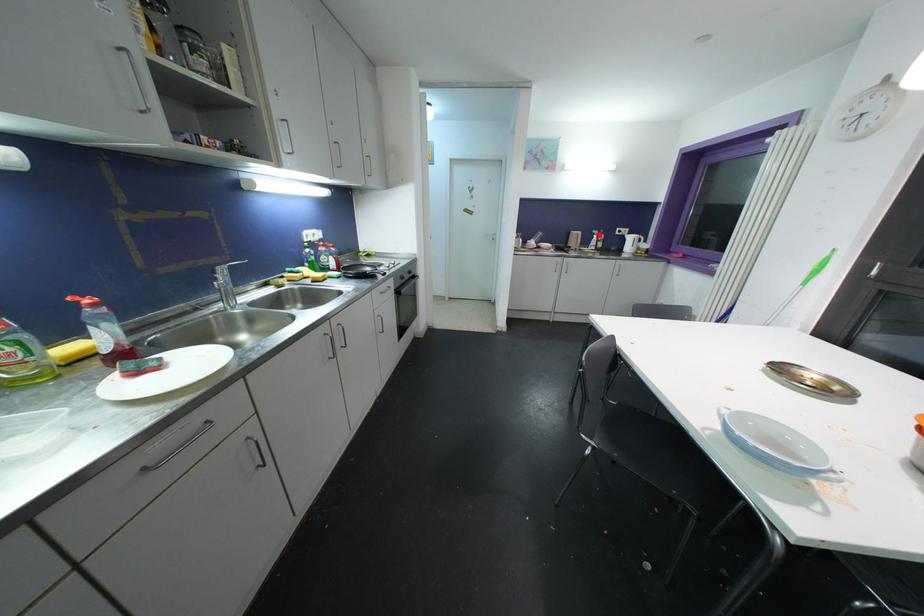
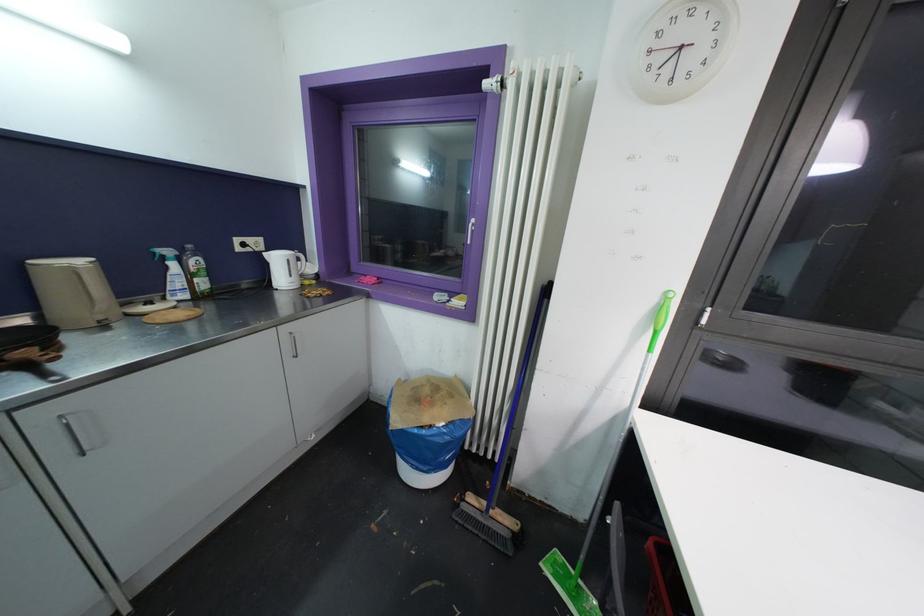
The point at the highlighted location is marked in the first image. Where is the corresponding point in the second image?

(171, 254)